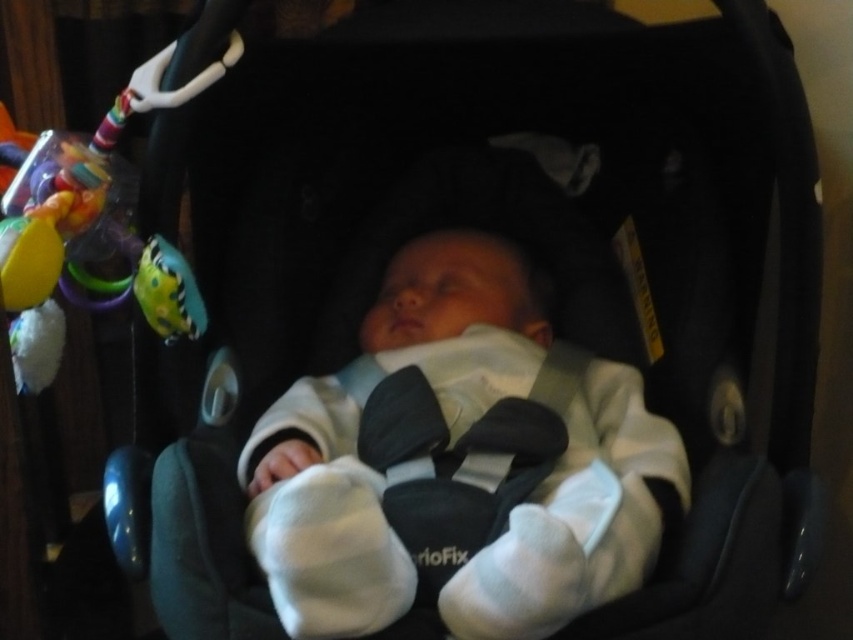
Does white soft baby at center have a smaller size compared to rubberized green and yellow toy at left?

Actually, white soft baby at center might be larger than rubberized green and yellow toy at left.

Between white soft baby at center and rubberized green and yellow toy at left, which one is positioned lower?

Positioned lower is white soft baby at center.

Describe the element at coordinates (457, 464) in the screenshot. I see `white soft baby at center` at that location.

Where is `white soft baby at center`? This screenshot has height=640, width=853. white soft baby at center is located at coordinates (457, 464).